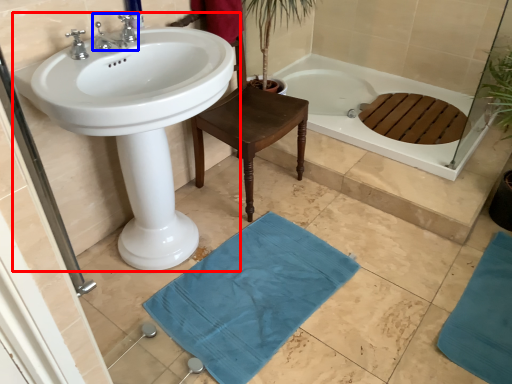
Question: Which object appears farthest to the camera in this image, sink (highlighted by a red box) or tap (highlighted by a blue box)?

Choices:
 (A) sink
 (B) tap

Answer: (B)